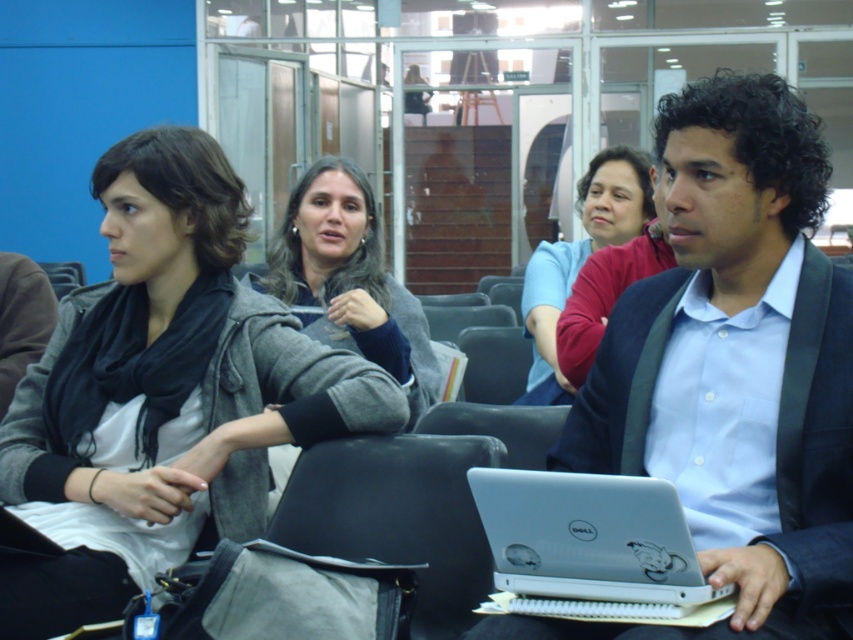
Which is below, matte gray jacket at center or matte blue shirt at center?

matte gray jacket at center is below.

Measure the distance between point (161, 189) and camera.

Point (161, 189) is 2.90 meters from camera.

Is point (137, 269) in front of point (592, 204)?

Yes.

Locate an element on the screen. The height and width of the screenshot is (640, 853). matte gray jacket at center is located at coordinates (163, 394).

Is silver metallic laptop at lower center above gray fleece jacket at center?

Incorrect, silver metallic laptop at lower center is not positioned above gray fleece jacket at center.

Which is below, silver metallic laptop at lower center or gray fleece jacket at center?

Positioned lower is silver metallic laptop at lower center.

This screenshot has width=853, height=640. Find the location of `silver metallic laptop at lower center`. silver metallic laptop at lower center is located at coordinates (x=589, y=536).

Is gray fleece jacket at center to the right of matte blue shirt at center from the viewer's perspective?

In fact, gray fleece jacket at center is to the left of matte blue shirt at center.

Is point (293, 211) farther from camera compared to point (550, 243)?

That is False.

Is point (300, 305) less distant than point (529, 372)?

Yes, it is.

You are a GUI agent. You are given a task and a screenshot of the screen. Output one action in this format:
    pyautogui.click(x=<x>, y=<y>)
    Task: Click on the gray fleece jacket at center
    The image size is (853, 640).
    Given the screenshot: What is the action you would take?
    pyautogui.click(x=347, y=278)